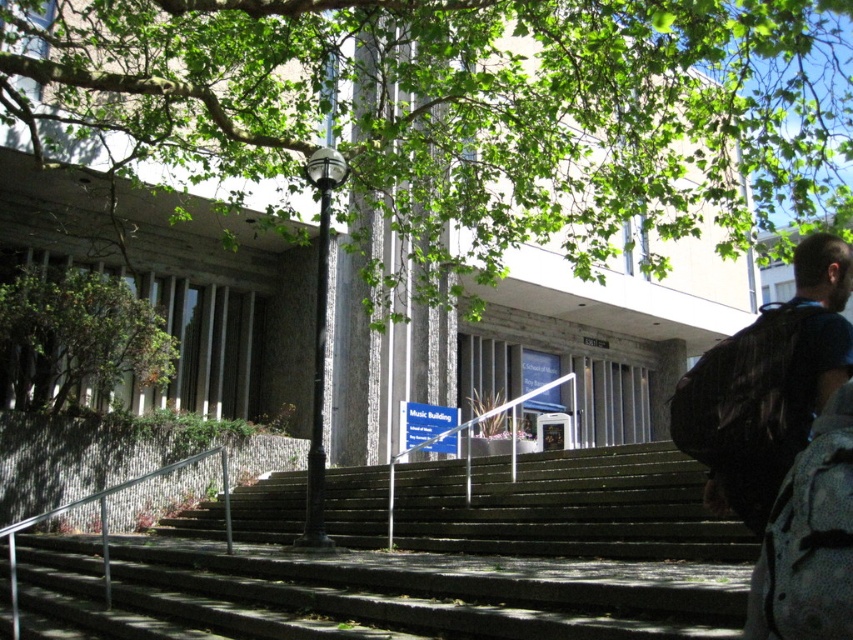
You are standing at the base of the building looking up at the entrance. There are two points marked on the steps leading up to the building. The first point is at coordinates point (33, 577) and the second point is at coordinates point (761, 362). Which point is closer to you as you stand at the base?

Point (33, 577) is closer to you than point (761, 362) because it is further to the viewer.

You are a delivery person trying to navigate to the entrance of the building. You see the green wooden stairs at center and the green leafy tree at left. Which object is wider?

The green wooden stairs at center is wider than the green leafy tree at left.

You are a delivery person approaching the building and need to leave your dark blue backpack at right near the entrance. However, there is a green leafy tree at upper center in the way. Can you place your backpack there without moving the tree?

The green leafy tree at upper center is to the right of dark blue backpack at right, meaning the backpack is actually positioned to the left of the tree. Since the tree is in the upper area, it does not block the placement of the backpack at the right side near the entrance. Therefore, you can leave your dark blue backpack at right there without moving the tree.